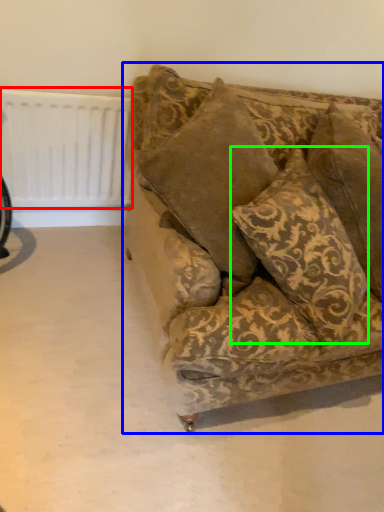
Question: Estimate the real-world distances between objects in this image. Which object is farther from radiator (highlighted by a red box), studio couch (highlighted by a blue box) or pillow (highlighted by a green box)?

Choices:
 (A) studio couch
 (B) pillow

Answer: (B)